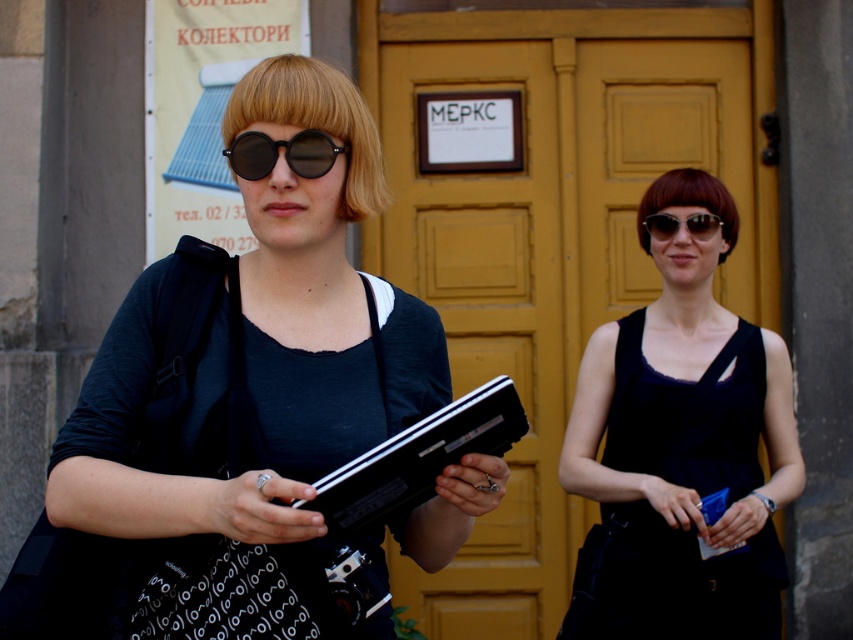
You are a photographer who needs to position your equipment precisely. You have a black matte sunglasses at center. Where exactly should you place it to match the scene?

The black matte sunglasses at center should be placed at point coordinates of (x=283, y=154) to match the scene.

You are a photographer who just arrived at the location. You need to retrieve your equipment. Which item is positioned lower between the matte black laptop at left and the sunglasses at center?

The matte black laptop at left is located below sunglasses at center, so the matte black laptop at left is positioned lower.

You are an observer looking at the scene. There is a black matte dress at center and a black matte sunglasses at center. Which object is bigger?

The black matte dress at center is larger in size than the black matte sunglasses at center.